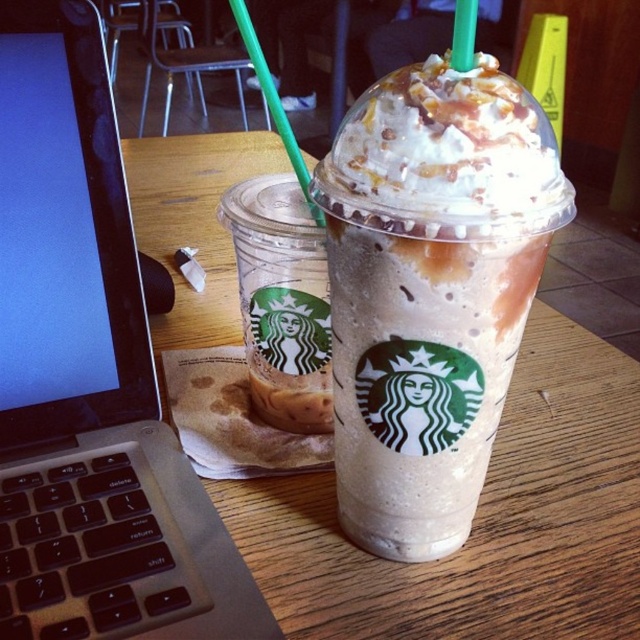
Question: Based on their relative distances, which object is nearer to the green plastic straw at upper center?

Choices:
 (A) translucent plastic cup at left
 (B) wooden table at center

Answer: (A)

Question: Is translucent plastic cup at left smaller than green plastic straw at upper center?

Choices:
 (A) no
 (B) yes

Answer: (B)

Question: Which point appears closest to the camera in this image?

Choices:
 (A) (298, 150)
 (B) (422, 406)
 (C) (296, 316)
 (D) (288, 528)

Answer: (B)

Question: Which object is positioned farthest from the green plastic straw at upper center?

Choices:
 (A) whipped cream topped caramel frappuccino at center
 (B) wooden table at center
 (C) black plastic laptop at left
 (D) translucent plastic cup at left

Answer: (B)

Question: Does black plastic laptop at left have a lesser width compared to whipped cream topped caramel frappuccino at center?

Choices:
 (A) yes
 (B) no

Answer: (B)

Question: Does whipped cream topped caramel frappuccino at center lie in front of green plastic straw at upper center?

Choices:
 (A) no
 (B) yes

Answer: (B)